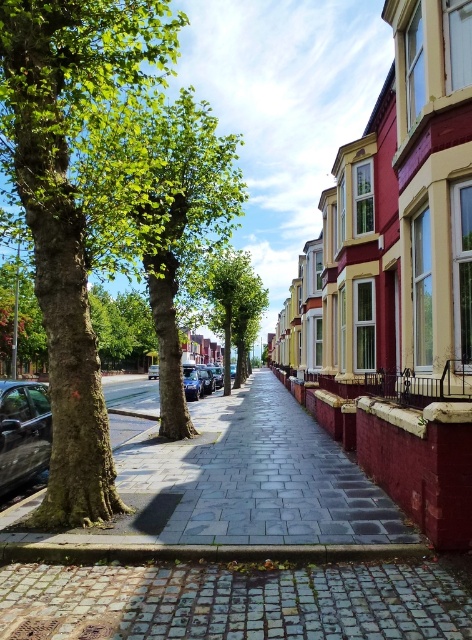
You are a delivery person standing on the sidewalk in the scene. You need to deliver a package to the house closest to the green leafy tree at center. Which house should you go to?

The green leafy tree at center is 17.25 meters from the camera, so the closest house to it would be the one nearest to the tree along the street. Since the houses are lined up along the street, the house closest to the green leafy tree at center would be the one directly adjacent to the tree on either side. However, without specific information about the exact positions of the houses relative to the tree, it is impossible to determine which specific house is closest. The question cannot be answered with the

You are a delivery person trying to park your 2.5 meters tall delivery van. You see the green leafy tree at center and the shiny black car at left. Which object is taller, and can your van fit between them without hitting anything?

The green leafy tree at center is taller than the shiny black car at left. Since the van is 2.5 meters tall and the tree is taller, the van can fit between them as long as it stays below the tree height. However, ensure there is enough clearance between the tree and the car.